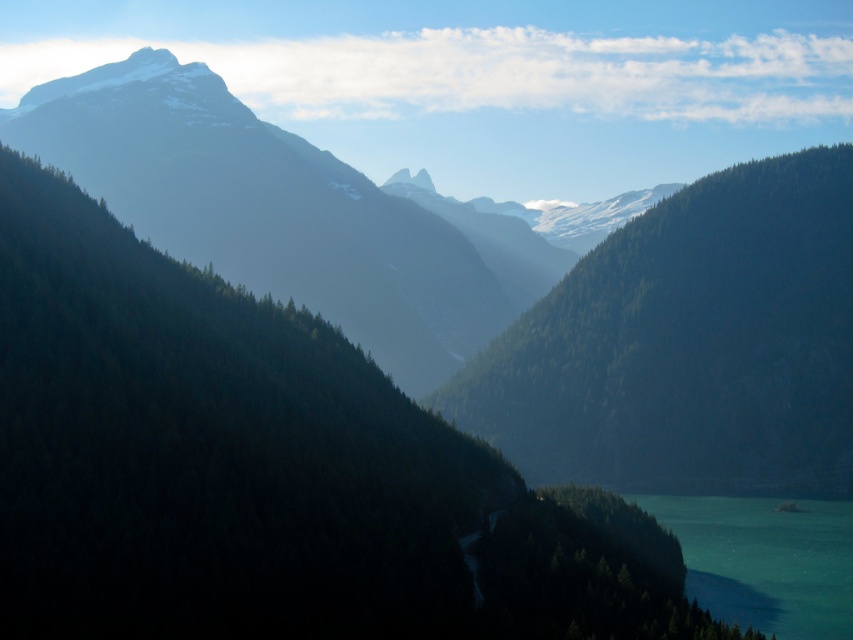
Question: Is green forested mountain range at center smaller than teal glossy water at lower right?

Choices:
 (A) no
 (B) yes

Answer: (A)

Question: Which is nearer to the teal glossy water at lower right?

Choices:
 (A) green textured forest at center
 (B) green forested mountain range at center

Answer: (A)

Question: Does green forested mountain range at center have a lesser width compared to teal glossy water at lower right?

Choices:
 (A) no
 (B) yes

Answer: (A)

Question: Can you confirm if green textured forest at center is thinner than teal glossy water at lower right?

Choices:
 (A) yes
 (B) no

Answer: (B)

Question: Among these points, which one is farthest from the camera?

Choices:
 (A) (640, 444)
 (B) (701, 452)

Answer: (A)

Question: Among these points, which one is nearest to the camera?

Choices:
 (A) (836, 636)
 (B) (434, 314)

Answer: (A)